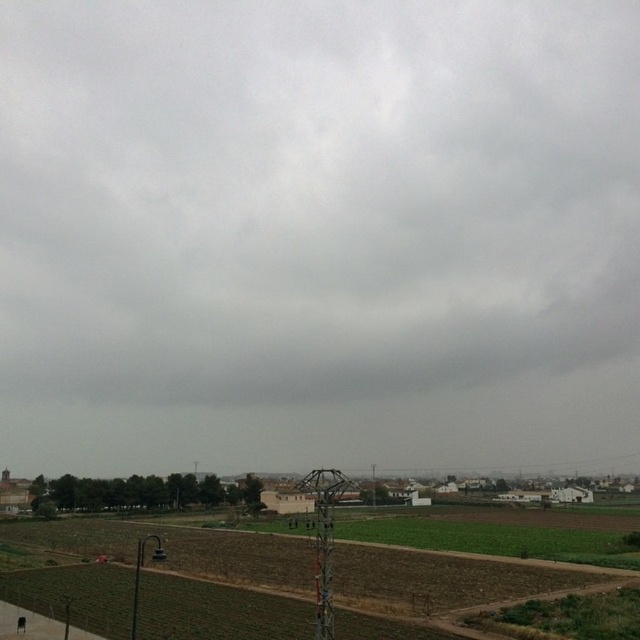
Question: Is gray cloudy sky at upper center positioned in front of brown soil at lower center?

Choices:
 (A) yes
 (B) no

Answer: (B)

Question: Is the position of gray cloudy sky at upper center less distant than that of brown soil at lower center?

Choices:
 (A) no
 (B) yes

Answer: (A)

Question: Does gray cloudy sky at upper center appear under brown soil at lower center?

Choices:
 (A) yes
 (B) no

Answer: (B)

Question: Which point is farther from the camera taking this photo?

Choices:
 (A) click(x=97, y=531)
 (B) click(x=115, y=312)

Answer: (B)